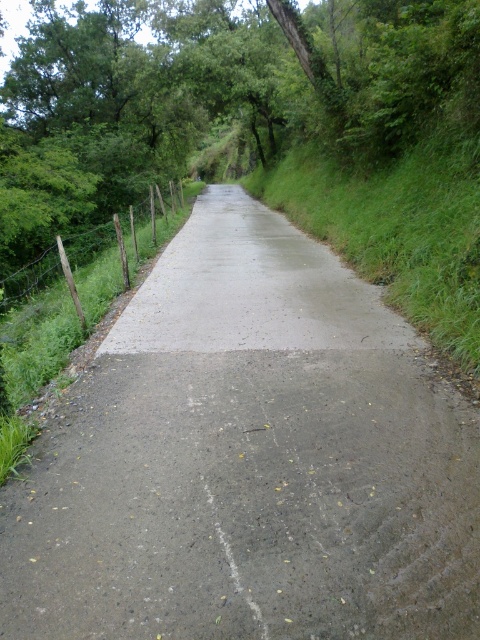
You are a delivery driver approaching the gray concrete road at center and the green wire fence at left. Which one is taller?

The gray concrete road at center is not as tall as the green wire fence at left, so the green wire fence at left is taller.

You are standing at the starting point of the road and see two points marked on the road ahead. The first point is at coordinates point (408, 413) and the second is at point (38, 268). Which point is closer to you as you stand at the beginning of the road?

Point (408, 413) is closer to the camera than point (38, 268), so the first point is closer to you.